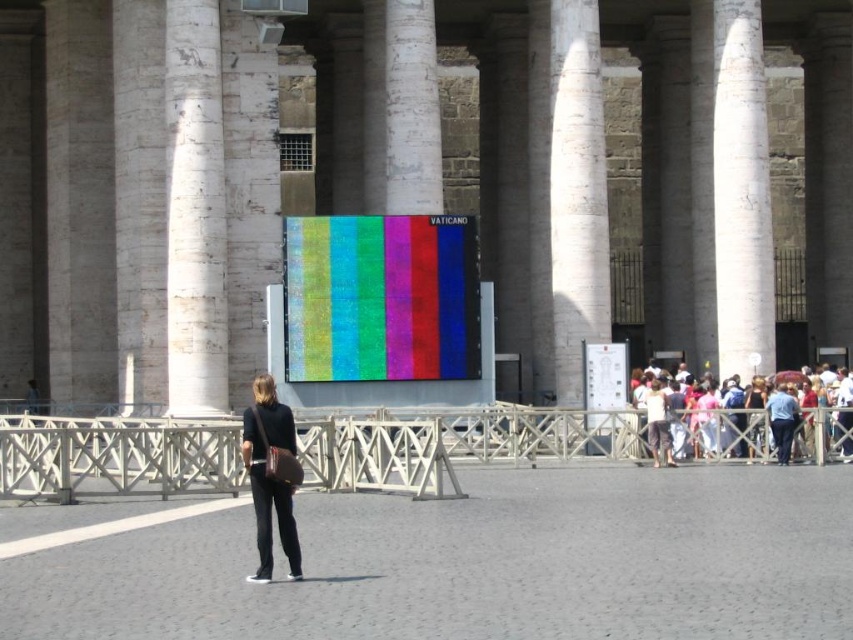
Question: Estimate the real-world distances between objects in this image. Which object is closer to the multicolored fabric crowd at right?

Choices:
 (A) matte black pants at center
 (B) white marble pillar at left
 (C) white marble pillar at center
 (D) textured fabric screen at center

Answer: (C)

Question: Observing the image, what is the correct spatial positioning of multicolored fabric crowd at right in reference to matte black pants at center?

Choices:
 (A) below
 (B) above

Answer: (B)

Question: Is the position of textured fabric screen at center more distant than that of matte black pants at center?

Choices:
 (A) yes
 (B) no

Answer: (A)

Question: Which point is closer to the camera taking this photo?

Choices:
 (A) coord(579,54)
 (B) coord(402,266)

Answer: (B)

Question: Based on their relative distances, which object is farther from the matte black pants at center?

Choices:
 (A) white marble pillar at left
 (B) multicolored fabric crowd at right
 (C) textured fabric screen at center
 (D) white marble pillar at center

Answer: (D)

Question: Does textured fabric screen at center appear on the left side of white marble pillar at center?

Choices:
 (A) no
 (B) yes

Answer: (B)